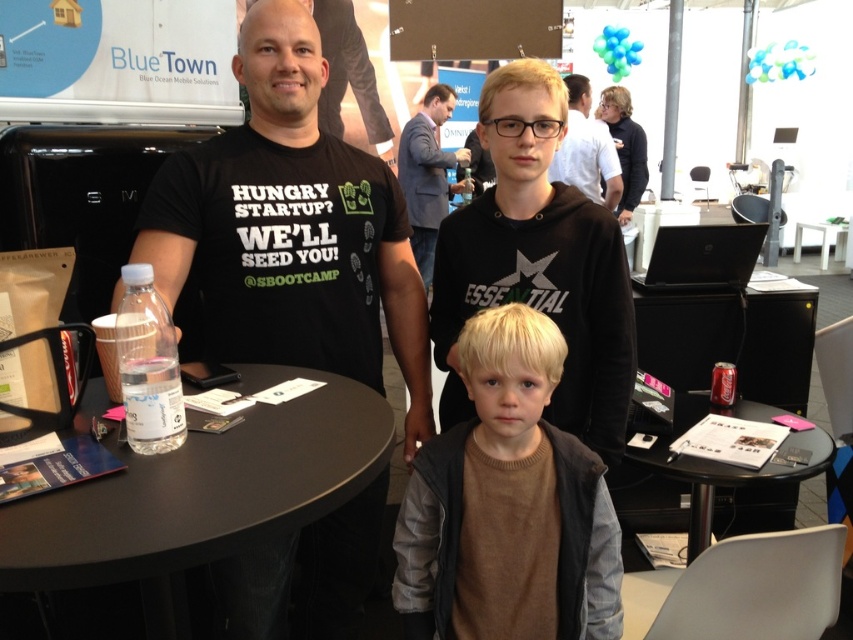
Question: Which point is closer to the camera?

Choices:
 (A) matte black shirt at upper center
 (B) transparent plastic table at center
 (C) black plastic table at lower right
 (D) brown fleece vest at center

Answer: (B)

Question: Which object appears farthest from the camera in this image?

Choices:
 (A) matte black shirt at upper center
 (B) brown fleece vest at center
 (C) dark gray suit at center
 (D) transparent plastic table at center

Answer: (C)

Question: Is black matte t-shirt at center bigger than matte black shirt at upper center?

Choices:
 (A) yes
 (B) no

Answer: (B)

Question: Is black plastic table at lower right to the left of dark gray suit at center from the viewer's perspective?

Choices:
 (A) yes
 (B) no

Answer: (B)

Question: Which of these objects is positioned farthest from the black plastic table at lower right?

Choices:
 (A) dark gray suit at center
 (B) matte black shirt at upper center
 (C) brown fleece vest at center

Answer: (A)

Question: From the image, what is the correct spatial relationship of brown fleece vest at center in relation to transparent plastic table at center?

Choices:
 (A) below
 (B) above

Answer: (B)